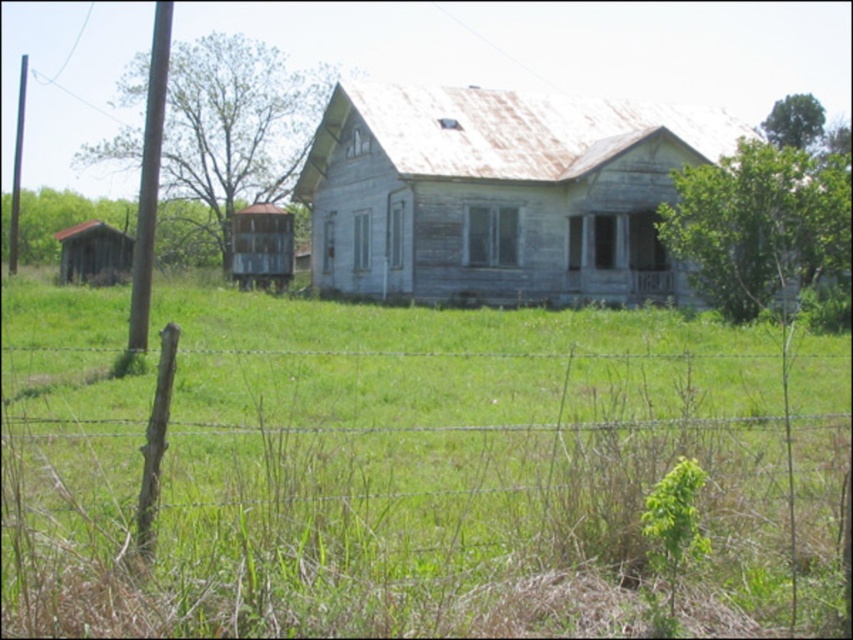
Question: Is barbed wire fence at lower left smaller than green leafy plant at lower right?

Choices:
 (A) no
 (B) yes

Answer: (A)

Question: Is barbed wire fence at lower left positioned in front of green leafy plant at lower right?

Choices:
 (A) no
 (B) yes

Answer: (B)

Question: Which point is farther to the camera?

Choices:
 (A) (677, 490)
 (B) (502, 496)

Answer: (B)

Question: Is barbed wire fence at lower left wider than green leafy plant at lower right?

Choices:
 (A) no
 (B) yes

Answer: (B)

Question: Which of the following is the closest to the observer?

Choices:
 (A) (840, 595)
 (B) (671, 579)

Answer: (B)

Question: Which point is farther from the camera taking this photo?

Choices:
 (A) (537, 520)
 (B) (662, 525)

Answer: (A)